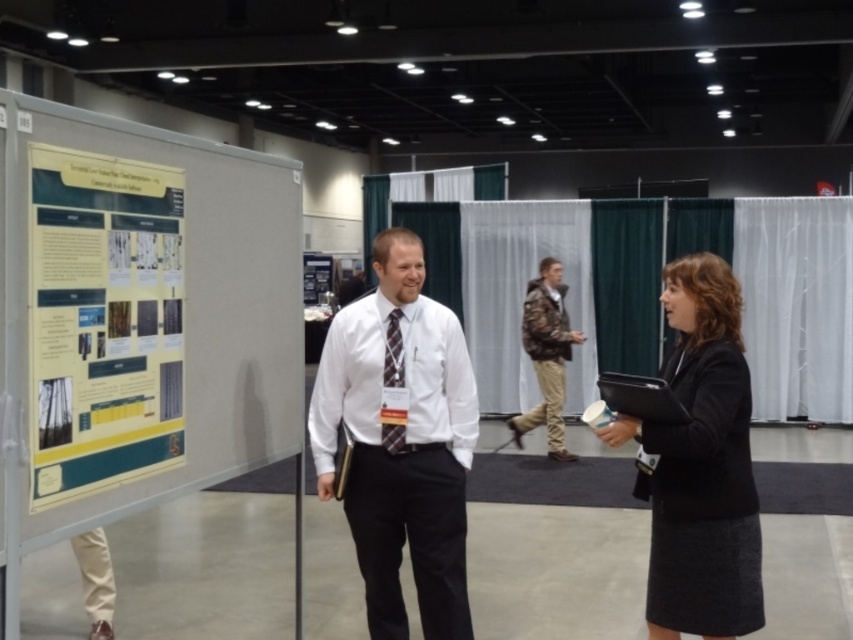
Is yellow paper poster at left positioned before camouflage jacket at center?

Yes, it is.

Is point (33, 310) less distant than point (531, 413)?

Yes, it is.

Is point (49, 440) more distant than point (544, 310)?

No.

Image resolution: width=853 pixels, height=640 pixels. In order to click on yellow paper poster at left in this screenshot , I will do `click(103, 321)`.

The width and height of the screenshot is (853, 640). Describe the element at coordinates (103, 321) in the screenshot. I see `yellow paper poster at left` at that location.

Looking at this image, is yellow paper poster at left below plaid fabric tie at center?

Actually, yellow paper poster at left is above plaid fabric tie at center.

Is point (132, 417) farther from viewer compared to point (395, 422)?

That is False.

Where is `yellow paper poster at left`? yellow paper poster at left is located at coordinates click(x=103, y=321).

Who is more distant from viewer, (554, 412) or (401, 346)?

Point (554, 412)

Who is higher up, camouflage jacket at center or plaid fabric tie at center?

Positioned higher is plaid fabric tie at center.

Is point (520, 445) less distant than point (390, 385)?

No, (520, 445) is behind (390, 385).

Find the location of a particular element. The height and width of the screenshot is (640, 853). camouflage jacket at center is located at coordinates (546, 355).